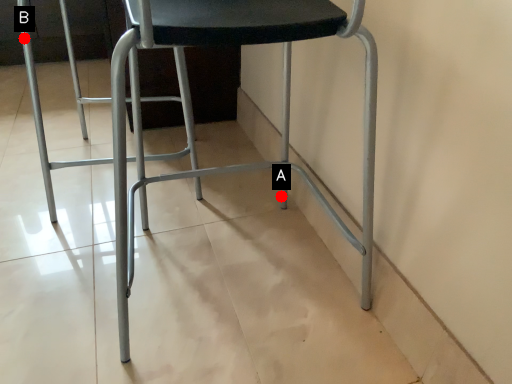
Question: Two points are circled on the image, labeled by A and B beside each circle. Which point appears farthest from the camera in this image?

Choices:
 (A) A is further
 (B) B is further

Answer: (A)